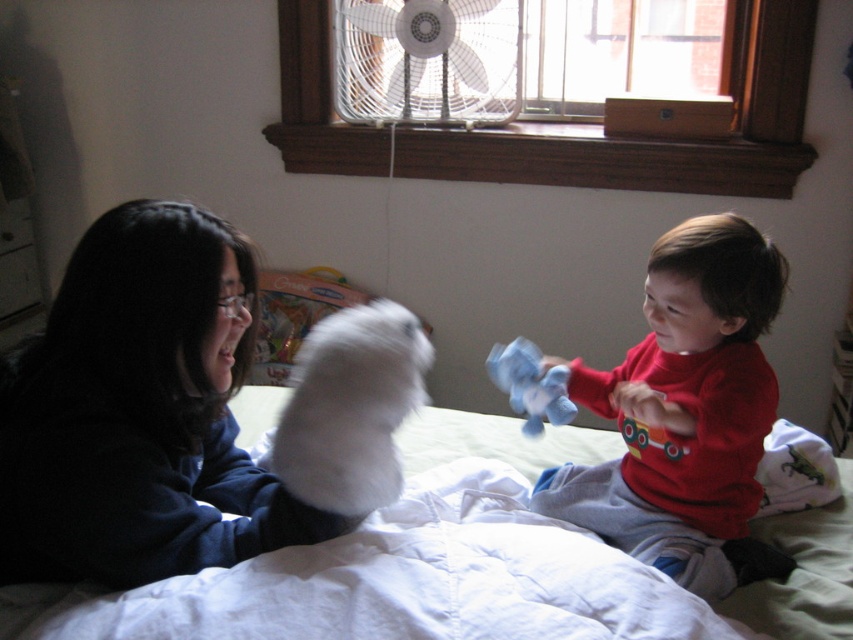
Based on the photo, you are standing at the center of the room and see a point marked at coordinates [685,413]. Which object does this point belong to?

The point at coordinates [685,413] belongs to the red cotton shirt at right.

You are trying to decide which item to place in a small drawer. The drawer can only fit items up to the size of the blue plush toy at center. Based on the scene, can the red cotton shirt at right fit into the drawer?

The red cotton shirt at right is wider than the blue plush toy at center, so it cannot fit into the drawer designed for items up to the size of the blue plush toy at center.

You are a child who wants to reach the blue plush toy at center from the white quilted bed at center. Can you easily grab it without moving from the bed?

The white quilted bed at center is in front of the blue plush toy at center, so the blue plush toy at center is behind the bed. You cannot easily grab the blue plush toy at center without moving from the bed because it is behind the white quilted bed at center.